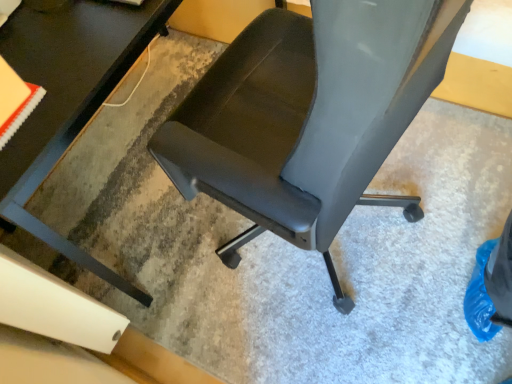
Find the location of `matte black chair at center`. matte black chair at center is located at coordinates (307, 114).

Measure the distance between point [448,13] and camera.

The depth of point [448,13] is 45.10 centimeters.

What do you see at coordinates (307, 114) in the screenshot?
I see `matte black chair at center` at bounding box center [307, 114].

This screenshot has width=512, height=384. What do you see at coordinates (69, 99) in the screenshot?
I see `black glossy table at center` at bounding box center [69, 99].

What is the approximate height of black glossy table at center?

It is 75.22 centimeters.

This screenshot has height=384, width=512. Find the location of `black glossy table at center`. black glossy table at center is located at coordinates (69, 99).

You are a GUI agent. You are given a task and a screenshot of the screen. Output one action in this format:
    pyautogui.click(x=<x>, y=<y>)
    Task: Click on the matte black chair at center
    The height and width of the screenshot is (384, 512).
    Given the screenshot: What is the action you would take?
    pyautogui.click(x=307, y=114)

Can you confirm if black glossy table at center is positioned to the right of matte black chair at center?

In fact, black glossy table at center is to the left of matte black chair at center.

Is black glossy table at center in front of or behind matte black chair at center in the image?

Clearly, black glossy table at center is behind matte black chair at center.

Which is closer, (150, 21) or (241, 205)?

The point (241, 205) is closer to the camera.

Consider the image. From the image's perspective, is black glossy table at center over matte black chair at center?

Yes, from the image's perspective, black glossy table at center is over matte black chair at center.

From a real-world perspective, is black glossy table at center physically above matte black chair at center?

No, from a real-world perspective, black glossy table at center is not on top of matte black chair at center.

Does black glossy table at center have a lesser width compared to matte black chair at center?

In fact, black glossy table at center might be wider than matte black chair at center.

Is black glossy table at center shorter than matte black chair at center?

Correct, black glossy table at center is not as tall as matte black chair at center.

Can you confirm if black glossy table at center is smaller than matte black chair at center?

No, black glossy table at center is not smaller than matte black chair at center.

Do you think black glossy table at center is within matte black chair at center, or outside of it?

black glossy table at center exists outside the volume of matte black chair at center.

Looking at this image, would you say black glossy table at center is a long distance from matte black chair at center?

Actually, black glossy table at center and matte black chair at center are a little close together.

Is black glossy table at center oriented towards matte black chair at center?

Yes.

What's the angular difference between black glossy table at center and matte black chair at center's facing directions?

180 degrees.

Measure the distance between black glossy table at center and matte black chair at center.

black glossy table at center and matte black chair at center are 13.76 inches apart.

Find the location of a particular element. table located behind the matte black chair at center is located at coordinates (69, 99).

Would you say matte black chair at center is to the left or to the right of black glossy table at center in the picture?

Clearly, matte black chair at center is on the right of black glossy table at center in the image.

Is the position of matte black chair at center less distant than that of black glossy table at center?

Yes, it is.

Does point (317, 139) appear closer or farther from the camera than point (80, 4)?

Point (317, 139) is closer to the camera than point (80, 4).

From the image's perspective, which object appears higher, matte black chair at center or black glossy table at center?

From the image's view, black glossy table at center is above.

From a real-world perspective, relative to black glossy table at center, is matte black chair at center vertically above or below?

matte black chair at center is above black glossy table at center.

Between matte black chair at center and black glossy table at center, which one has smaller width?

Thinner between the two is matte black chair at center.

Which of these two, matte black chair at center or black glossy table at center, stands shorter?

black glossy table at center.

Based on their sizes in the image, would you say matte black chair at center is bigger or smaller than black glossy table at center?

In the image, matte black chair at center appears to be smaller than black glossy table at center.

Consider the image. Is matte black chair at center not within black glossy table at center?

That's correct, matte black chair at center is outside of black glossy table at center.

Is matte black chair at center positioned far away from black glossy table at center?

matte black chair at center is near black glossy table at center, not far away.

Does matte black chair at center turn towards black glossy table at center?

Yes, matte black chair at center is oriented towards black glossy table at center.

What are the coordinates of `chair lying below the black glossy table at center (from the image's perspective)` in the screenshot? It's located at (307, 114).

At what (x,y) coordinates should I click in order to perform the action: click on chair above the black glossy table at center (from a real-world perspective). Please return your answer as a coordinate pair (x, y). Looking at the image, I should click on (307, 114).

Locate an element on the screen. This screenshot has width=512, height=384. chair that is in front of the black glossy table at center is located at coordinates (307, 114).